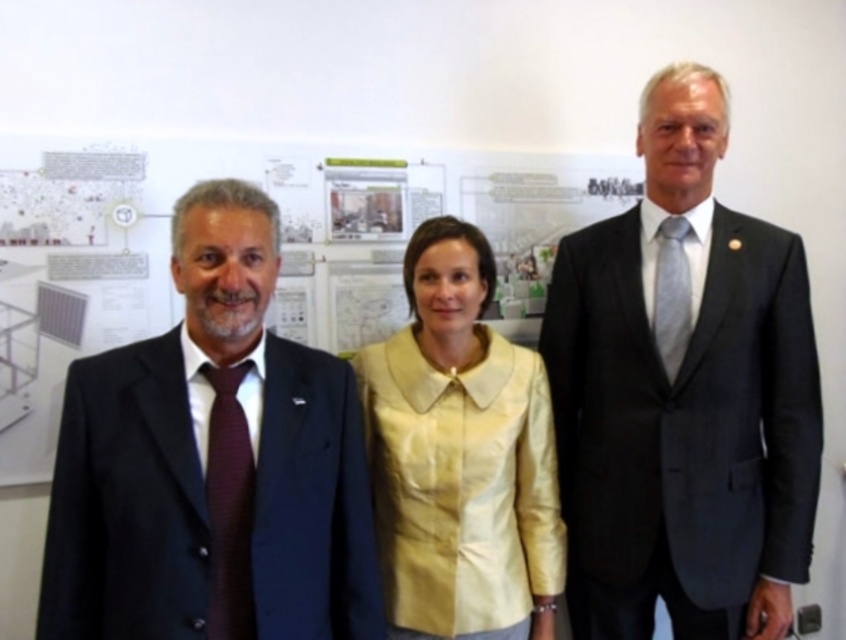
You are an event organizer arranging a photo shoot for a team meeting. You need to position two key team members correctly based on their attire. The team members are wearing dark gray suit at center and matte yellow blouse at center. According to the scene description, which one should be positioned to the right of the other?

The dark gray suit at center should be positioned to the right of the matte yellow blouse at center because the description states that the dark gray suit at center is to the right of the matte yellow blouse at center.

You are an architect reviewing a team photo for a project meeting. In the image, you see the maroon textured tie at left. Where is the maroon textured tie located relative to the other team members?

The maroon textured tie at left is located at point 0.794 on the x and 0.272 on the y coordinate system, which places it on the leftmost person in the image.